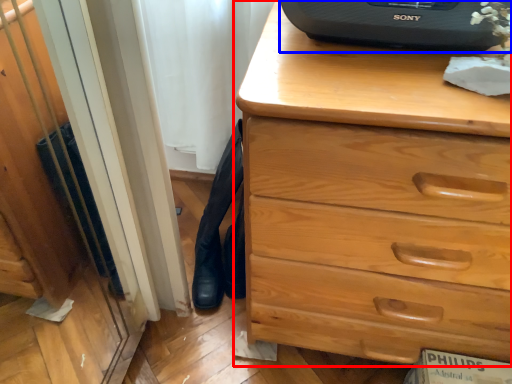
Question: Which point is further to the camera, chest of drawers (highlighted by a red box) or desktop computer (highlighted by a blue box)?

Choices:
 (A) chest of drawers
 (B) desktop computer

Answer: (B)